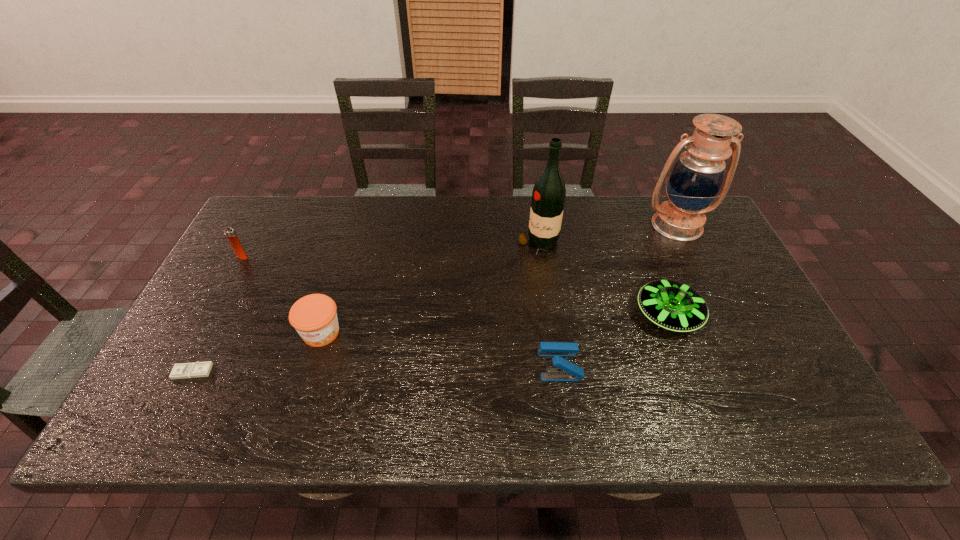
The width and height of the screenshot is (960, 540). What are the coordinates of `vacant space at the far edge` in the screenshot? It's located at (593, 207).

In the image, there is a desktop. What are the coordinates of `vacant region at the near edge` in the screenshot? It's located at (288, 404).

You are a GUI agent. You are given a task and a screenshot of the screen. Output one action in this format:
    pyautogui.click(x=<x>, y=<y>)
    Task: Click on the free point at the left edge
    The image size is (960, 540).
    Given the screenshot: What is the action you would take?
    pyautogui.click(x=205, y=342)

The height and width of the screenshot is (540, 960). In the image, there is a desktop. In order to click on free space at the right edge in this screenshot , I will do `click(780, 364)`.

The height and width of the screenshot is (540, 960). In the image, there is a desktop. Identify the location of vacant space at the near left corner. (182, 403).

What are the coordinates of `free space at the far right corner of the desktop` in the screenshot? It's located at (693, 242).

Locate an element on the screen. The image size is (960, 540). free space between the money and the third object from left to right is located at coordinates (257, 352).

The width and height of the screenshot is (960, 540). I want to click on free space that is in between the stapler and the jam, so click(x=441, y=349).

I want to click on free space between the igniter and the jam, so click(x=281, y=295).

At what (x,y) coordinates should I click in order to perform the action: click on vacant region between the igniter and the saucer. Please return your answer as a coordinate pair (x, y). Looking at the image, I should click on (455, 286).